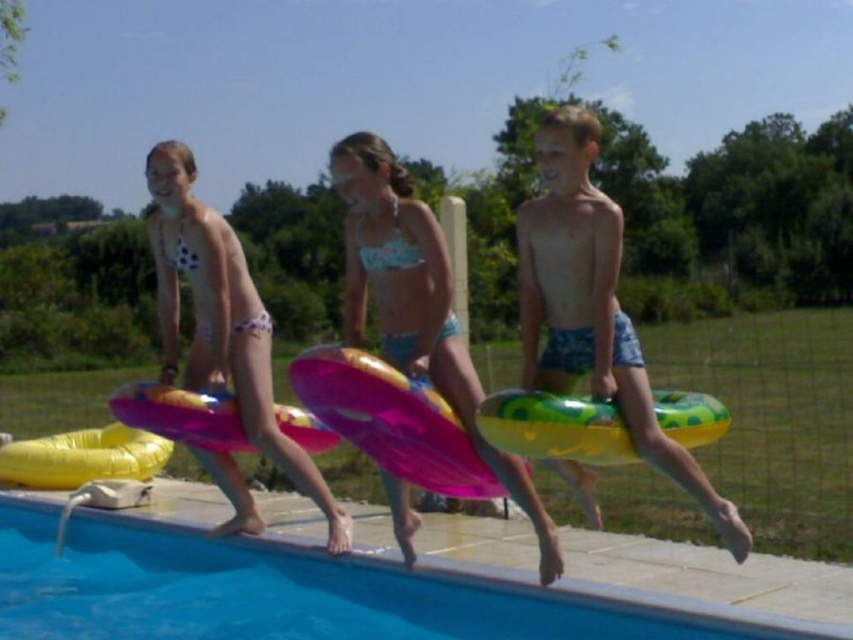
Question: Does blue smooth water at lower center have a lesser width compared to white polka dot bikini at center?

Choices:
 (A) yes
 (B) no

Answer: (A)

Question: Can you confirm if blue smooth water at lower center is smaller than inflatable ring at right?

Choices:
 (A) no
 (B) yes

Answer: (A)

Question: Which of the following is the farthest from the observer?

Choices:
 (A) blue smooth water at lower center
 (B) light blue bikini at center
 (C) white polka dot bikini at center
 (D) inflatable ring at right

Answer: (C)

Question: Which object is closer to the camera taking this photo?

Choices:
 (A) light blue bikini at center
 (B) white polka dot bikini at center

Answer: (A)

Question: Which point is farther to the camera?

Choices:
 (A) blue smooth water at lower center
 (B) light blue bikini at center

Answer: (B)

Question: Is blue smooth water at lower center thinner than light blue bikini at center?

Choices:
 (A) yes
 (B) no

Answer: (B)